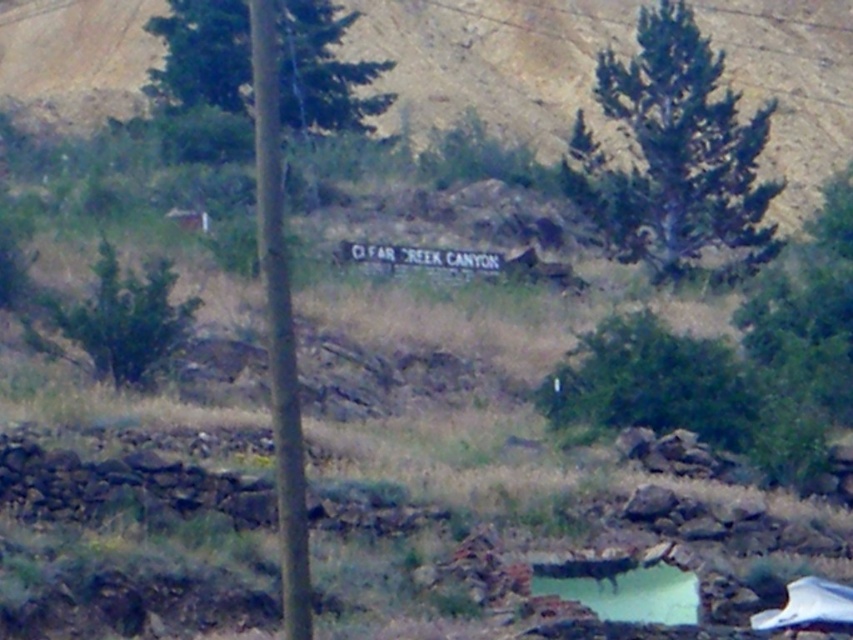
Who is shorter, green wood pole at center or green reflective water at center?

With less height is green reflective water at center.

Which is more to the left, green wood pole at center or green reflective water at center?

From the viewer's perspective, green wood pole at center appears more on the left side.

Image resolution: width=853 pixels, height=640 pixels. Find the location of `green wood pole at center`. green wood pole at center is located at coordinates (279, 326).

Is point (698, 141) closer to camera compared to point (190, 64)?

Yes, point (698, 141) is closer to viewer.

Which is below, green textured tree at upper right or green leafy tree at upper center?

Positioned lower is green textured tree at upper right.

Does point (695, 257) come closer to viewer compared to point (194, 86)?

Yes, it is.

Where is `green textured tree at upper right`? The image size is (853, 640). green textured tree at upper right is located at coordinates (676, 156).

Which is below, green grassy hillside at center or green textured tree at upper right?

green textured tree at upper right is lower down.

This screenshot has width=853, height=640. In order to click on green grassy hillside at center in this screenshot , I will do `click(494, 64)`.

Where is `green grassy hillside at center`? The image size is (853, 640). green grassy hillside at center is located at coordinates (494, 64).